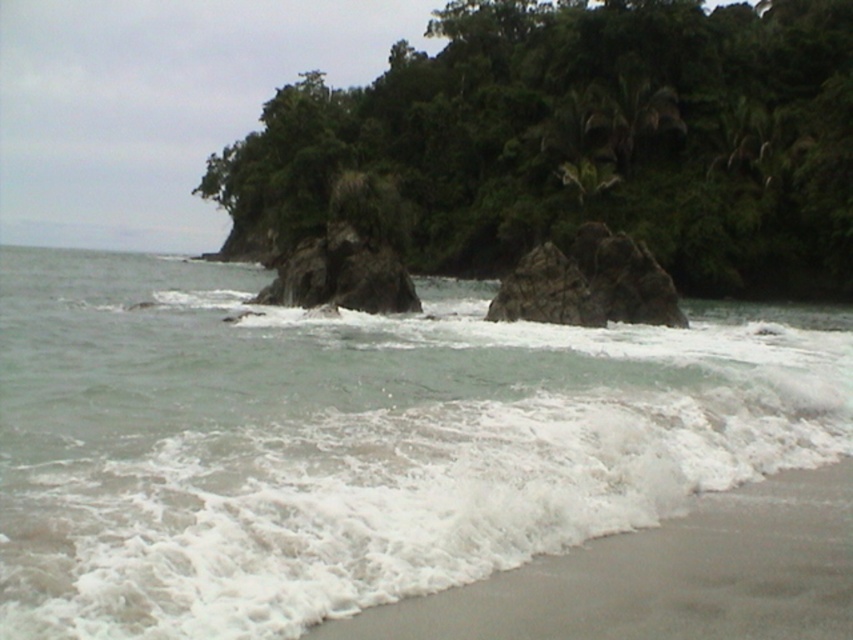
Question: Can you confirm if clear water at center is positioned above gray sand at lower right?

Choices:
 (A) yes
 (B) no

Answer: (A)

Question: From the image, what is the correct spatial relationship of clear water at center in relation to gray sand at lower right?

Choices:
 (A) right
 (B) left

Answer: (B)

Question: Among these points, which one is farthest from the camera?

Choices:
 (A) (386, 614)
 (B) (529, 509)

Answer: (B)

Question: Does clear water at center come behind gray sand at lower right?

Choices:
 (A) yes
 (B) no

Answer: (B)

Question: Which point is farther to the camera?

Choices:
 (A) (604, 573)
 (B) (531, 497)

Answer: (B)